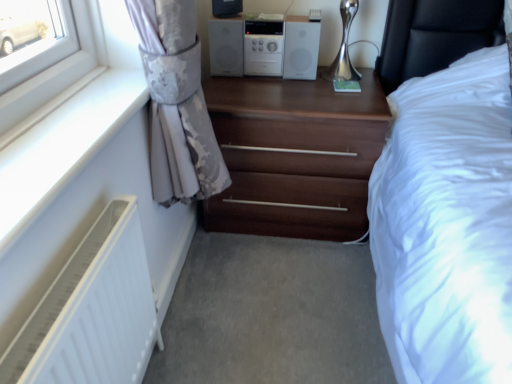
Question: Is silky gray curtain at left positioned behind white plastic radiator at lower left?

Choices:
 (A) no
 (B) yes

Answer: (B)

Question: Is silky gray curtain at left positioned in front of white plastic radiator at lower left?

Choices:
 (A) yes
 (B) no

Answer: (B)

Question: Can you confirm if silky gray curtain at left is thinner than white plastic radiator at lower left?

Choices:
 (A) no
 (B) yes

Answer: (B)

Question: Is white plastic radiator at lower left surrounded by silky gray curtain at left?

Choices:
 (A) yes
 (B) no

Answer: (B)

Question: Is silky gray curtain at left shorter than white plastic radiator at lower left?

Choices:
 (A) yes
 (B) no

Answer: (B)

Question: From a real-world perspective, is silky gray curtain at left located higher than white plastic radiator at lower left?

Choices:
 (A) no
 (B) yes

Answer: (A)

Question: Can you confirm if white plastic stereo at upper center is thinner than silky gray curtain at left?

Choices:
 (A) yes
 (B) no

Answer: (B)

Question: From the image's perspective, would you say white plastic stereo at upper center is positioned over silky gray curtain at left?

Choices:
 (A) yes
 (B) no

Answer: (A)

Question: Is silky gray curtain at left located within white plastic stereo at upper center?

Choices:
 (A) no
 (B) yes

Answer: (A)

Question: Can you see white plastic stereo at upper center touching silky gray curtain at left?

Choices:
 (A) no
 (B) yes

Answer: (A)

Question: Is white plastic stereo at upper center smaller than silky gray curtain at left?

Choices:
 (A) no
 (B) yes

Answer: (B)

Question: Does white plastic stereo at upper center lie behind silky gray curtain at left?

Choices:
 (A) no
 (B) yes

Answer: (B)

Question: Considering the relative sizes of matte black speaker at upper center and white plastic stereo at upper center in the image provided, is matte black speaker at upper center taller than white plastic stereo at upper center?

Choices:
 (A) no
 (B) yes

Answer: (A)